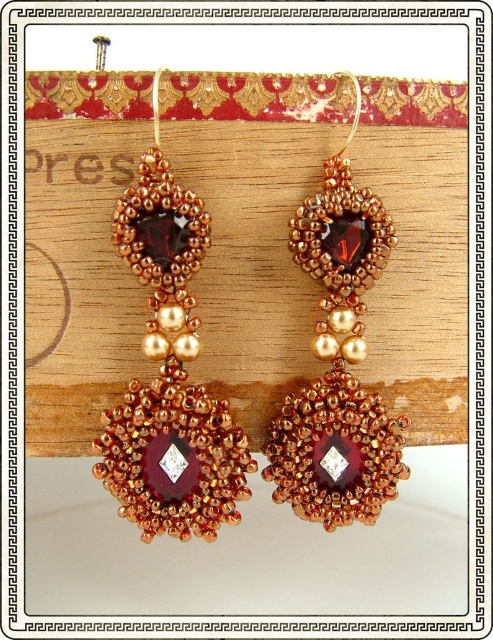
You are a customer at a jewelry store and want to buy the matte gold earrings at center and the copper beaded earring at center. However, you notice that one of them is partially hidden by the other. Which one is visible on top?

The matte gold earrings at center is in front of copper beaded earring at center, so the matte gold earrings at center is visible on top.